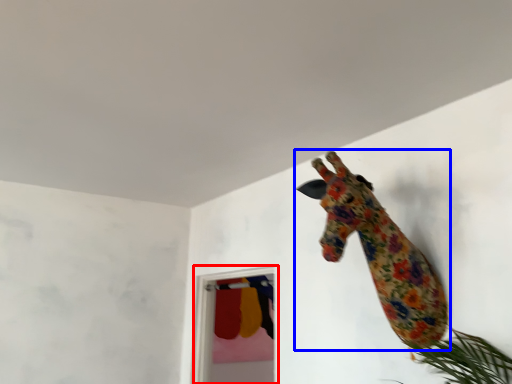
Question: Among these objects, which one is farthest to the camera, glass door (highlighted by a red box) or giraffe (highlighted by a blue box)?

Choices:
 (A) glass door
 (B) giraffe

Answer: (A)